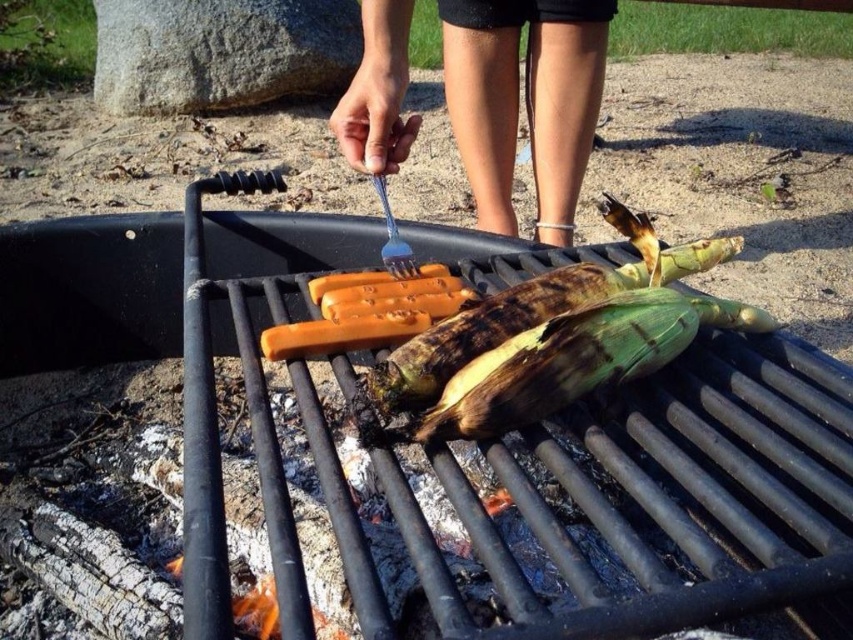
You are standing at the camera position and want to reach a point that is 60 centimeters away from you. Is the point at coordinate point (x=712, y=417) within your reach?

The distance of point (x=712, y=417) from camera is 62.79 centimeters, so the point is slightly out of reach since it is 2.79 centimeters beyond the 60 centimeter limit.

You are standing at the point labeled as point (500,340) and want to move to the point labeled as point (589,26). Considering the layout of the campsite, which direction should you move to reach your destination?

To move from point (500,340) to point (589,26), you should move to the left since point (589,26) is behind point (500,340).

You are a chef trying to grab the skinny blue plastic fork at upper center and the blue plastic fork at center. Which fork is located to the right of the other?

The skinny blue plastic fork at upper center is positioned on the right side of blue plastic fork at center.